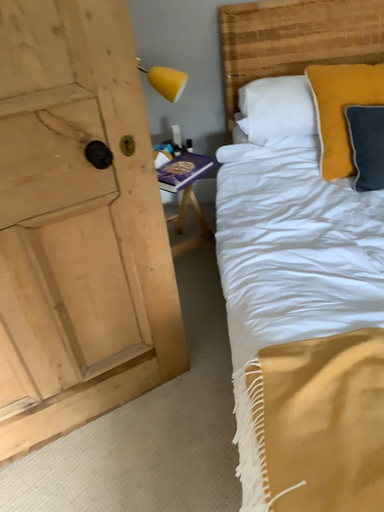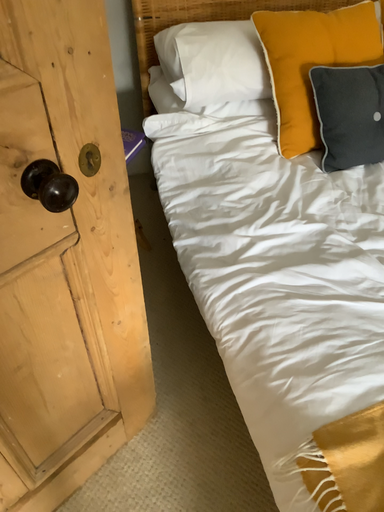
Question: How did the camera likely rotate when shooting the video?

Choices:
 (A) rotated right
 (B) rotated left

Answer: (A)